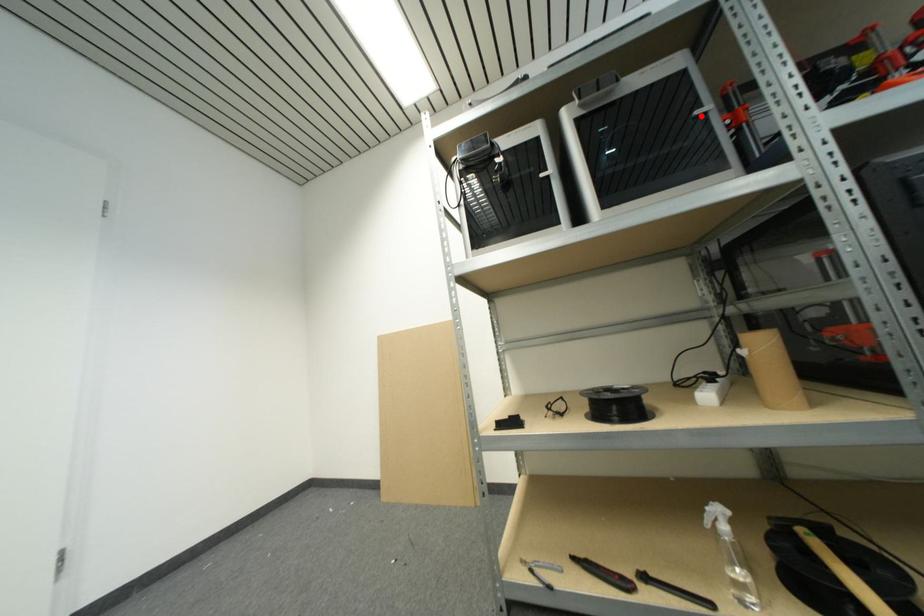
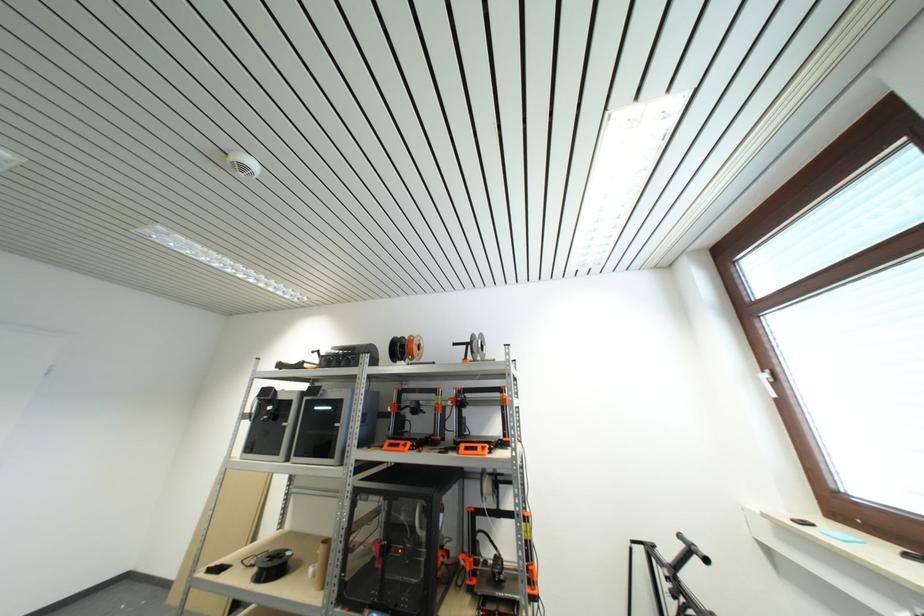
Find the pixel in the second image that matches the highlighted location in the first image.

(341, 427)